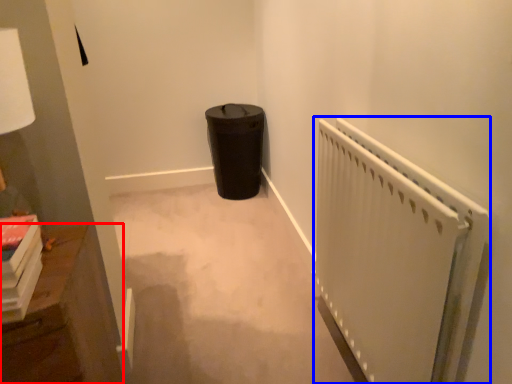
Question: Among these objects, which one is farthest to the camera, furniture (highlighted by a red box) or radiator (highlighted by a blue box)?

Choices:
 (A) furniture
 (B) radiator

Answer: (A)